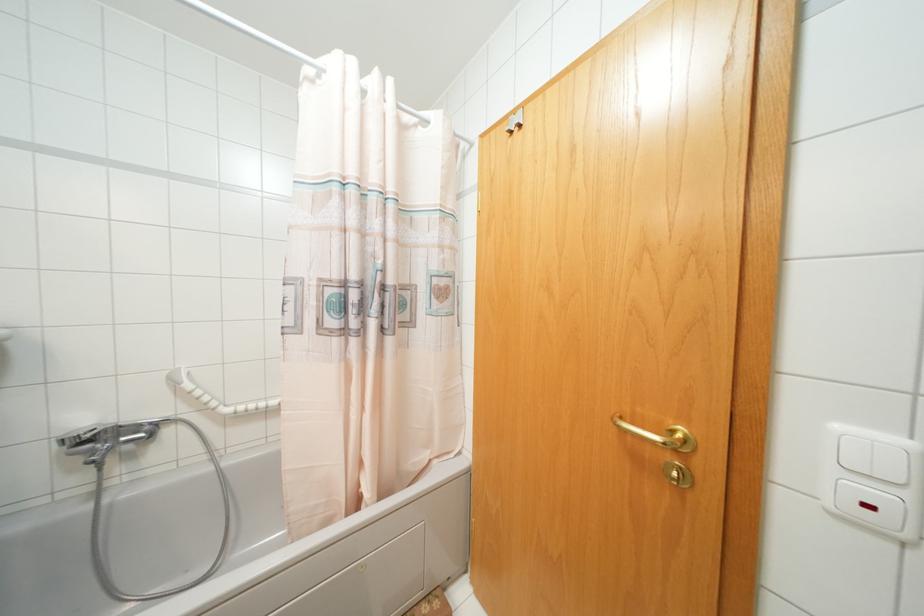
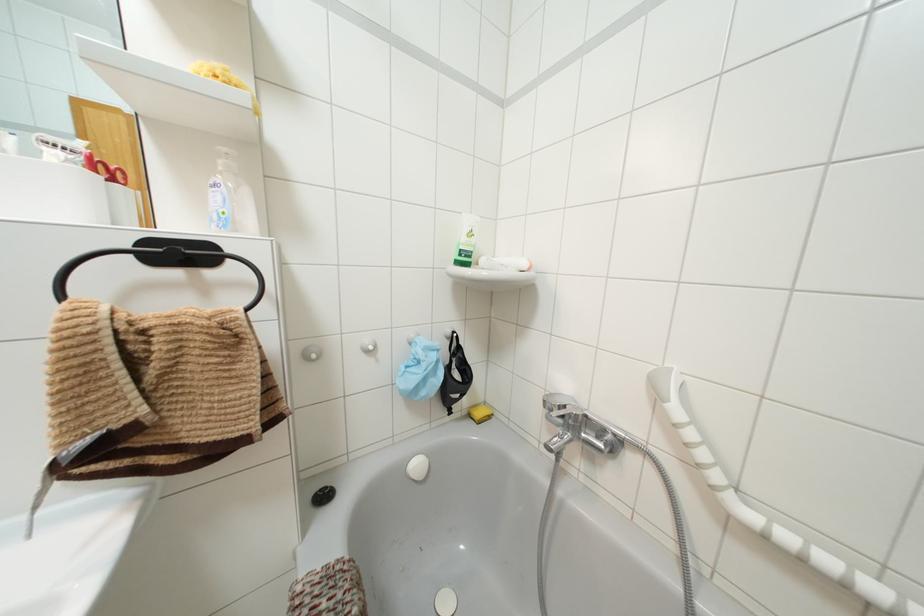
Question: The camera is either moving clockwise (left) or counter-clockwise (right) around the object. The first image is from the beginning of the video and the second image is from the end. Is the camera moving left or right when shooting the video?

Choices:
 (A) Left
 (B) Right

Answer: (B)